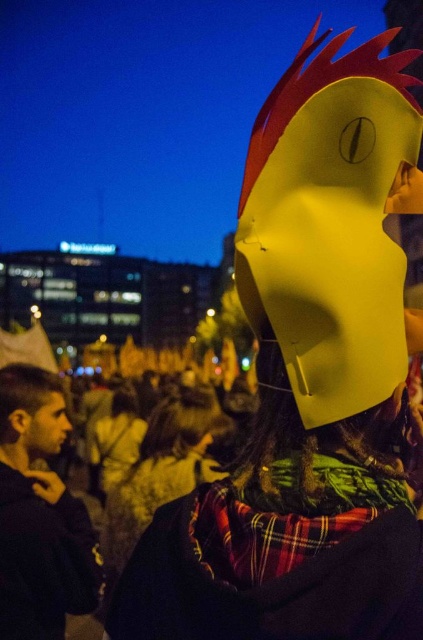
Question: Which of the following is the farthest from the observer?

Choices:
 (A) (41, 419)
 (B) (51, 404)
 (C) (187, 390)
 (D) (123, 522)

Answer: (C)

Question: Can you confirm if matte black hair at lower left is thinner than matte yellow helmet at center?

Choices:
 (A) no
 (B) yes

Answer: (B)

Question: Among these points, which one is nearest to the camera?

Choices:
 (A) (191, 444)
 (B) (142, 492)
 (C) (398, 157)
 (D) (49, 436)

Answer: (C)

Question: Which point is closer to the camera taking this photo?

Choices:
 (A) (65, 424)
 (B) (203, 419)
 (C) (3, 378)
 (D) (189, 449)

Answer: (C)

Question: Does yellow paper mask at upper right have a greater width compared to matte black hair at lower left?

Choices:
 (A) yes
 (B) no

Answer: (B)

Question: Can you confirm if matte yellow mask at upper center is bigger than smooth skin face at lower left?

Choices:
 (A) yes
 (B) no

Answer: (A)